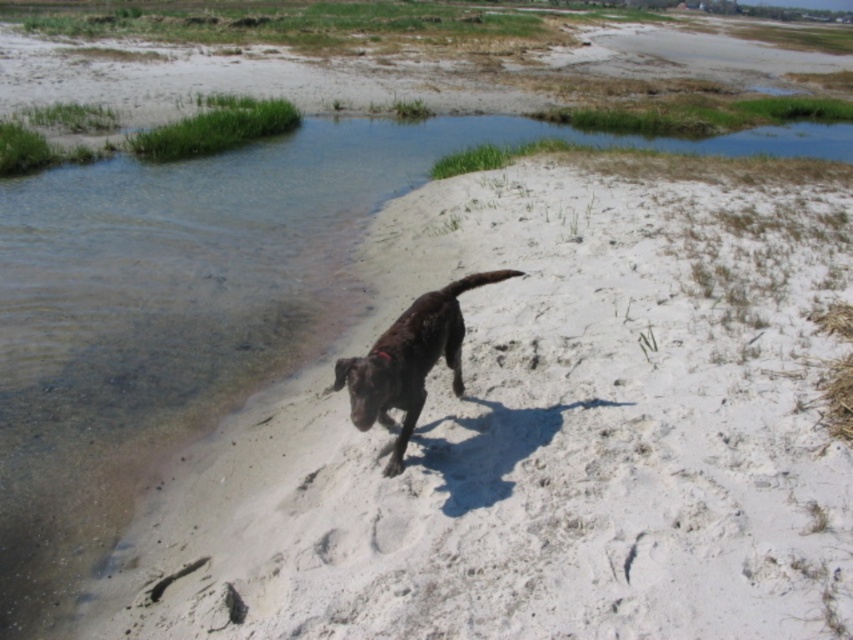
You are standing on the white sandy beach at center and want to reach the brown matte dog at center. Given that your walking speed is 3 feet per second, how many seconds will it take you to reach the dog?

The white sandy beach at center and brown matte dog at center are 6.52 feet apart. At a walking speed of 3 feet per second, it would take approximately 2.17 seconds to reach the dog.

You are a photographer trying to capture the brown matte dog at center on the white sandy beach at center. Since you want to highlight the dog, which area should you focus on to ensure the subject stands out?

The white sandy beach at center is bigger than the brown matte dog at center, so focusing on the dog will make it stand out against the larger background of the beach.

You are a photographer standing at the edge of the white sandy beach at center. You want to take a photo of the brown matte dog at center so that both the beach and the dog are clearly visible in the frame. Based on their heights, which one should you focus on first to ensure proper depth of field?

The white sandy beach at center is taller than the brown matte dog at center, so you should focus on the white sandy beach at center first to ensure both are in focus.